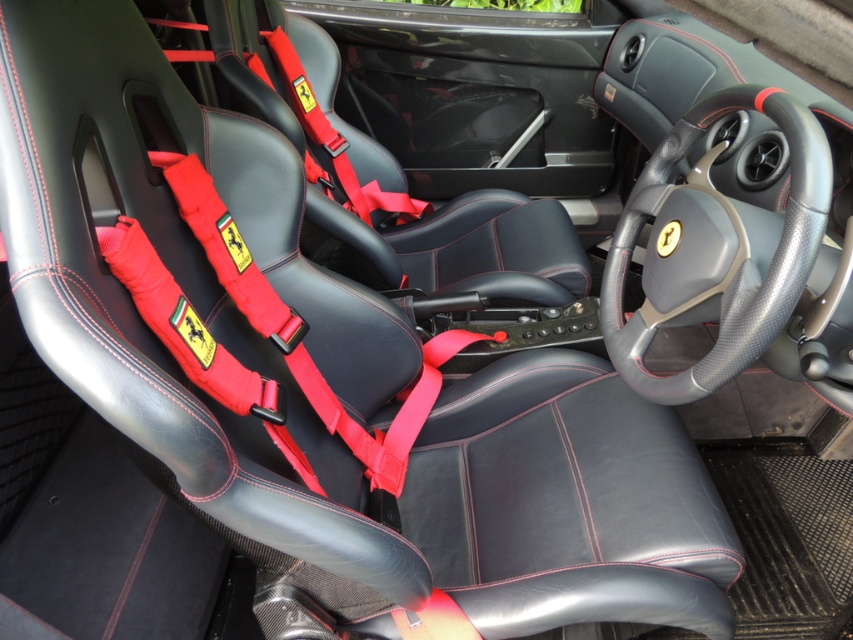
Question: In this image, where is carbon fiber steering wheel at center located relative to black leather seat at center?

Choices:
 (A) left
 (B) right

Answer: (B)

Question: Does carbon fiber steering wheel at center appear on the right side of black leather seat at center?

Choices:
 (A) yes
 (B) no

Answer: (A)

Question: Which point is farther from the camera taking this photo?

Choices:
 (A) (680, 300)
 (B) (229, 17)

Answer: (B)

Question: Does carbon fiber steering wheel at center lie in front of black leather seat at center?

Choices:
 (A) no
 (B) yes

Answer: (B)

Question: Which of the following is the closest to the observer?

Choices:
 (A) carbon fiber steering wheel at center
 (B) black leather seat at center

Answer: (A)